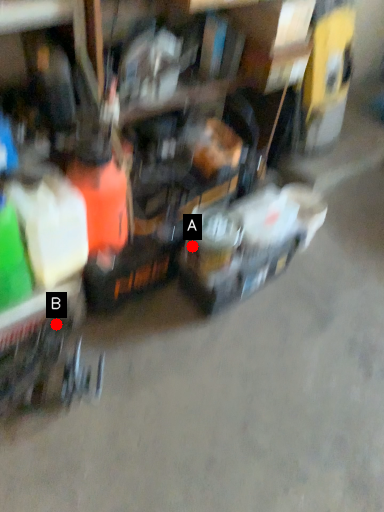
Question: Two points are circled on the image, labeled by A and B beside each circle. Which of the following is the farthest from the observer?

Choices:
 (A) A is further
 (B) B is further

Answer: (A)